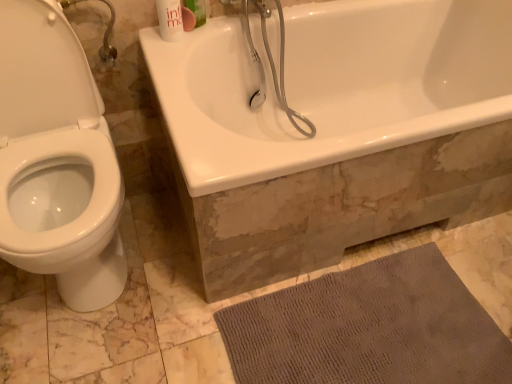
Question: From the image's perspective, is white glossy mouthwash at upper center, the first mouthwash when ordered from left to right, above gray textured bath mat at lower right?

Choices:
 (A) no
 (B) yes

Answer: (B)

Question: Is white glossy mouthwash at upper center, the first mouthwash when ordered from left to right, closer to the viewer compared to gray textured bath mat at lower right?

Choices:
 (A) yes
 (B) no

Answer: (B)

Question: Can you confirm if white glossy mouthwash at upper center, the 2th mouthwash positioned from the right, is taller than gray textured bath mat at lower right?

Choices:
 (A) no
 (B) yes

Answer: (B)

Question: Is white glossy mouthwash at upper center, the first mouthwash when ordered from left to right, positioned beyond the bounds of gray textured bath mat at lower right?

Choices:
 (A) yes
 (B) no

Answer: (A)

Question: Does white glossy mouthwash at upper center, the first mouthwash when ordered from left to right, have a larger size compared to gray textured bath mat at lower right?

Choices:
 (A) no
 (B) yes

Answer: (A)

Question: From a real-world perspective, is white glossy mouthwash at upper center, the first mouthwash when ordered from left to right, under gray textured bath mat at lower right?

Choices:
 (A) yes
 (B) no

Answer: (B)

Question: Would you say gray textured bath mat at lower right is part of white glossy bathtub at upper center's contents?

Choices:
 (A) yes
 (B) no

Answer: (B)

Question: Does white glossy bathtub at upper center have a greater height compared to gray textured bath mat at lower right?

Choices:
 (A) yes
 (B) no

Answer: (A)

Question: From a real-world perspective, is white glossy bathtub at upper center physically above gray textured bath mat at lower right?

Choices:
 (A) yes
 (B) no

Answer: (A)

Question: Is white glossy bathtub at upper center located outside gray textured bath mat at lower right?

Choices:
 (A) yes
 (B) no

Answer: (A)

Question: Considering the relative positions of white glossy bathtub at upper center and gray textured bath mat at lower right in the image provided, is white glossy bathtub at upper center to the left of gray textured bath mat at lower right from the viewer's perspective?

Choices:
 (A) no
 (B) yes

Answer: (A)

Question: Does white glossy bathtub at upper center have a greater width compared to gray textured bath mat at lower right?

Choices:
 (A) no
 (B) yes

Answer: (B)

Question: Is gray textured bath mat at lower right in contact with white glossy bathtub at upper center?

Choices:
 (A) no
 (B) yes

Answer: (A)